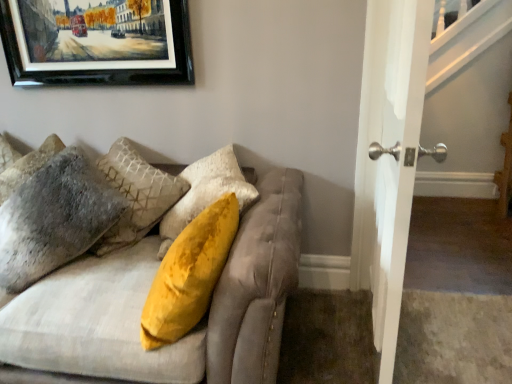
Question: From a real-world perspective, is fuzzy gray pillow at left, the 2th pillow positioned from the right, positioned above or below velvet beige couch at upper left?

Choices:
 (A) below
 (B) above

Answer: (B)

Question: Considering the positions of point (48, 157) and point (245, 228), is point (48, 157) closer or farther from the camera than point (245, 228)?

Choices:
 (A) closer
 (B) farther

Answer: (B)

Question: Estimate the real-world distances between objects in this image. Which object is closer to the fuzzy gray pillow at left, the 1th pillow viewed from the right?

Choices:
 (A) velvet beige couch at upper left
 (B) fuzzy gray pillow at left, placed as the 1th pillow when sorted from left to right
 (C) black matte picture frame at upper left

Answer: (B)

Question: Which object is the closest to the black matte picture frame at upper left?

Choices:
 (A) fuzzy gray pillow at left, the 2th pillow positioned from the right
 (B) velvet beige couch at upper left
 (C) fuzzy gray pillow at left, the 1th pillow viewed from the right

Answer: (A)